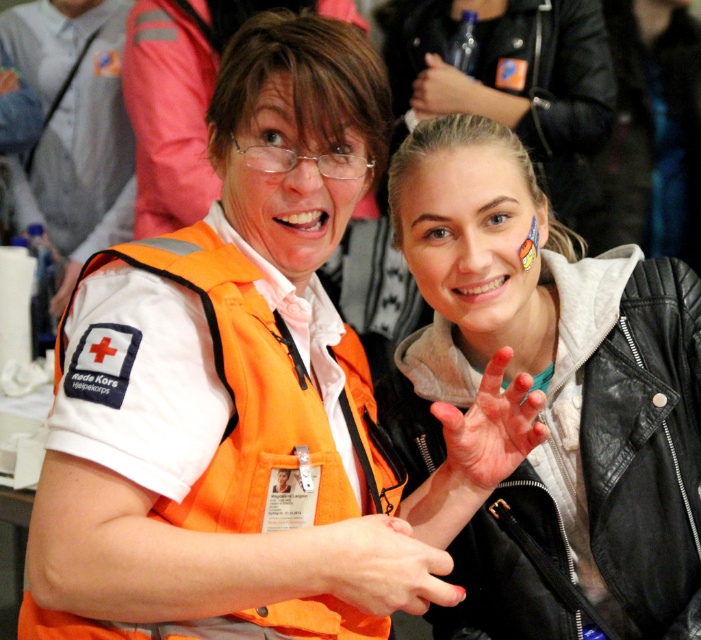
Question: Can you confirm if matte black hand at upper center is positioned to the right of matte orange vest at center?

Choices:
 (A) no
 (B) yes

Answer: (B)

Question: Which point is farther to the camera?

Choices:
 (A) orange matte hand at center
 (B) matte orange vest at center
 (C) matte black hand at upper center
 (D) orange fabric safety vest at left

Answer: (B)

Question: Which point appears closest to the camera in this image?

Choices:
 (A) (536, 369)
 (B) (64, 58)

Answer: (A)

Question: Can you confirm if orange reflective vest at center is thinner than matte black hand at upper center?

Choices:
 (A) no
 (B) yes

Answer: (A)

Question: Can you confirm if orange matte hand at center is wider than matte black hand at upper center?

Choices:
 (A) no
 (B) yes

Answer: (A)

Question: Which object is positioned closest to the pink matte hand at center?

Choices:
 (A) matte black hand at upper center
 (B) leather jacket at right
 (C) orange fabric safety vest at left
 (D) orange matte hand at center

Answer: (D)